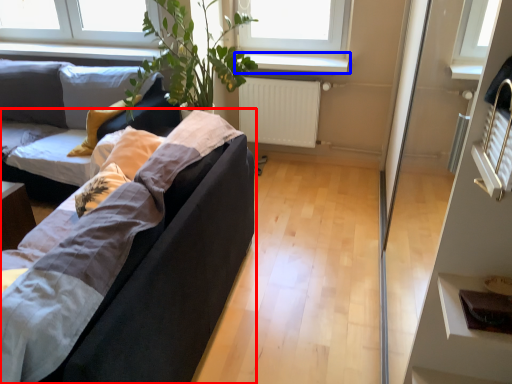
Question: Which object appears closest to the camera in this image, studio couch (highlighted by a red box) or window sill (highlighted by a blue box)?

Choices:
 (A) studio couch
 (B) window sill

Answer: (A)